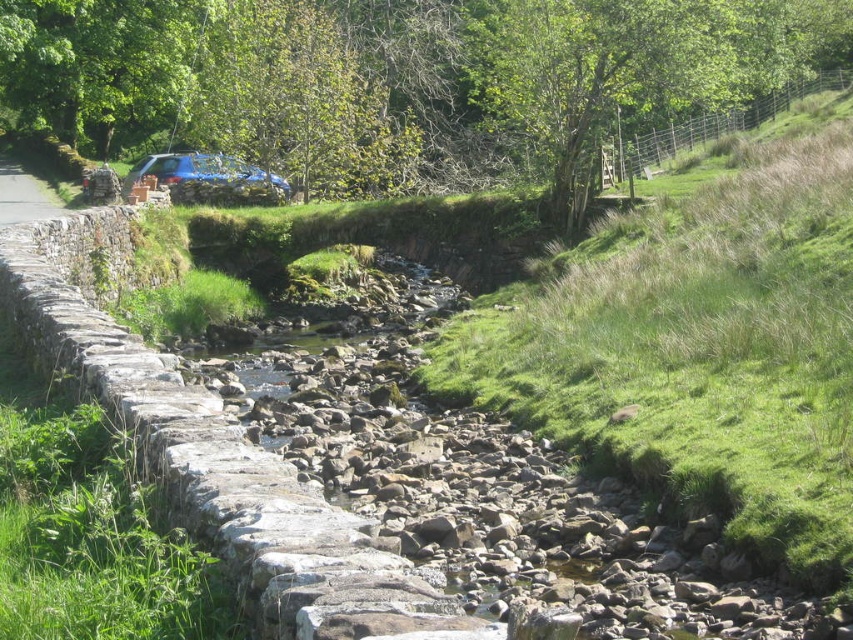
Question: Can you confirm if blue metallic car at center is thinner than gray stone path at left?

Choices:
 (A) no
 (B) yes

Answer: (B)

Question: Is blue metallic car at center closer to camera compared to gray stone path at left?

Choices:
 (A) no
 (B) yes

Answer: (A)

Question: Among these points, which one is farthest from the camera?

Choices:
 (A) pos(3,208)
 (B) pos(149,170)

Answer: (B)

Question: In this image, where is blue metallic car at center located relative to gray stone path at left?

Choices:
 (A) below
 (B) above

Answer: (B)